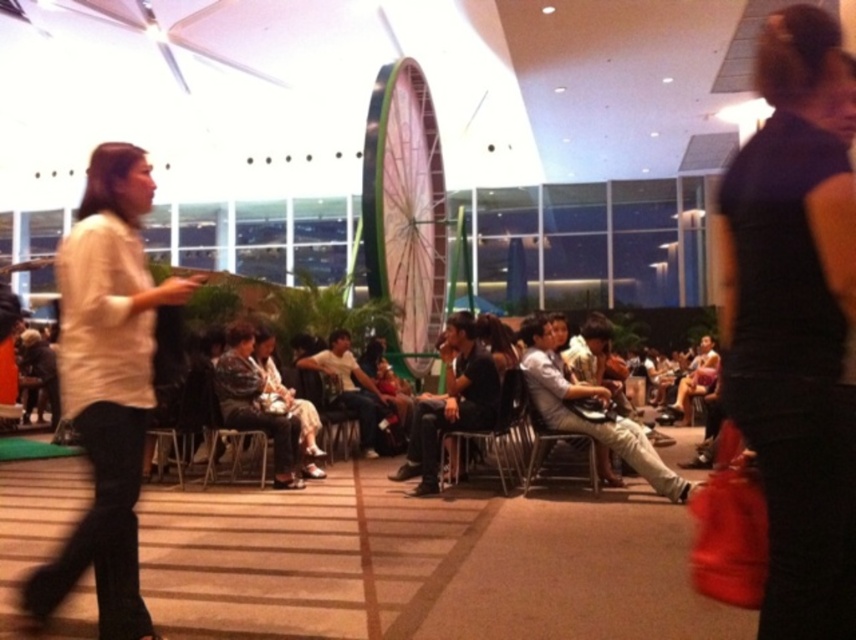
Question: Can you confirm if metallic gray chair at center is positioned above metallic silver chair at center?

Choices:
 (A) no
 (B) yes

Answer: (A)

Question: Which point is closer to the camera?

Choices:
 (A) (238, 458)
 (B) (120, 609)
 (C) (503, 384)
 (D) (797, 614)

Answer: (D)

Question: Which of these objects is positioned farthest from the wooden chair at center?

Choices:
 (A) black fabric dress at right
 (B) white matte shirt at left
 (C) metallic silver chair at center
 (D) black plastic chair at center

Answer: (A)

Question: From the image, what is the correct spatial relationship of metallic silver chair at center in relation to wooden chair at center?

Choices:
 (A) below
 (B) above

Answer: (A)

Question: Can you confirm if black fabric dress at right is positioned to the right of wooden chair at center?

Choices:
 (A) yes
 (B) no

Answer: (A)

Question: Among these objects, which one is farthest from the camera?

Choices:
 (A) metallic silver chair at center
 (B) black fabric dress at right
 (C) metallic gray chair at center

Answer: (A)